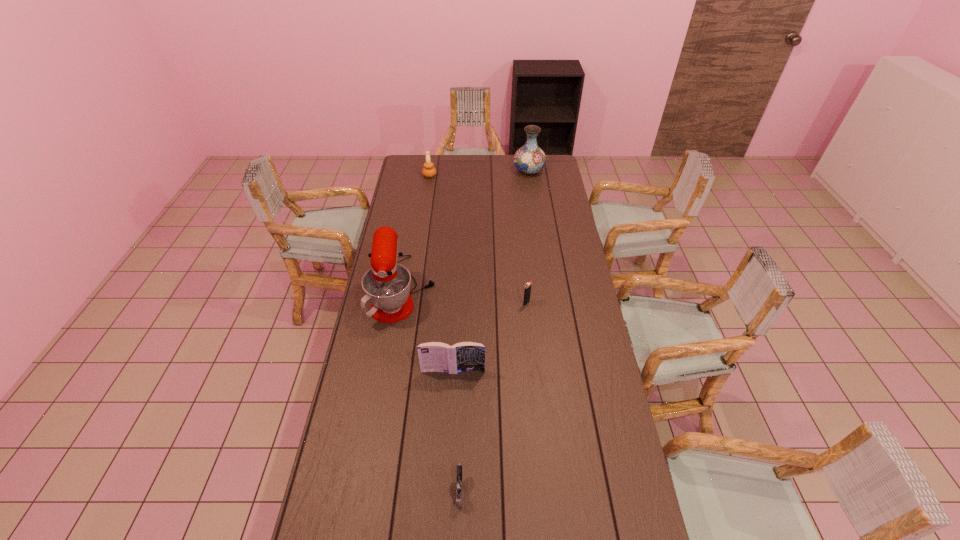
The image size is (960, 540). I want to click on free region located on the front cover of the second nearest object, so click(x=448, y=471).

The height and width of the screenshot is (540, 960). Identify the location of free space located on the right of the right igniter. (557, 303).

Where is `blank space located on the left of the left igniter`? This screenshot has width=960, height=540. blank space located on the left of the left igniter is located at coordinates (328, 488).

Locate an element on the screen. The height and width of the screenshot is (540, 960). vase that is positioned at the far edge is located at coordinates (529, 159).

Locate an element on the screen. candle_holder located at the far edge is located at coordinates (429, 171).

This screenshot has height=540, width=960. I want to click on mixer located at the left edge, so click(x=387, y=285).

Where is `candle_holder that is at the left edge`? candle_holder that is at the left edge is located at coordinates (429, 171).

The image size is (960, 540). In order to click on object present at the right edge in this screenshot , I will do `click(529, 159)`.

Locate an element on the screen. This screenshot has height=540, width=960. object located at the far left corner is located at coordinates (429, 171).

At what (x,y) coordinates should I click in order to perform the action: click on object at the far right corner. Please return your answer as a coordinate pair (x, y). This screenshot has height=540, width=960. Looking at the image, I should click on (529, 159).